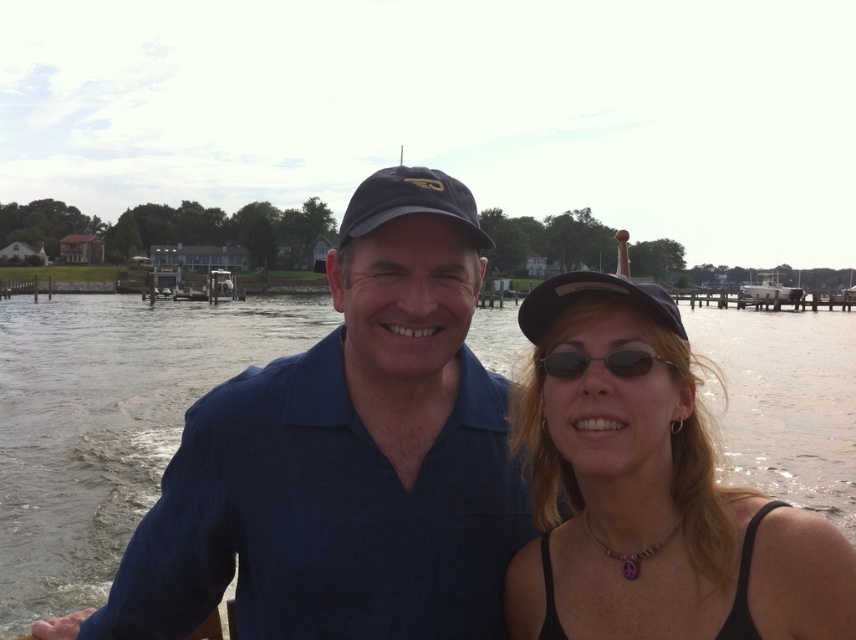
You are a photographer taking a picture of the two people in the scene. You notice the clear water at center and the black plastic sunglasses at center. Which object is positioned higher in the image?

The clear water at center is above the black plastic sunglasses at center, so the clear water at center is positioned higher in the image.

You are standing at the point with coordinates (345,458) in the image. What object is located at that point?

The blue fabric shirt at center is located at point (345,458).